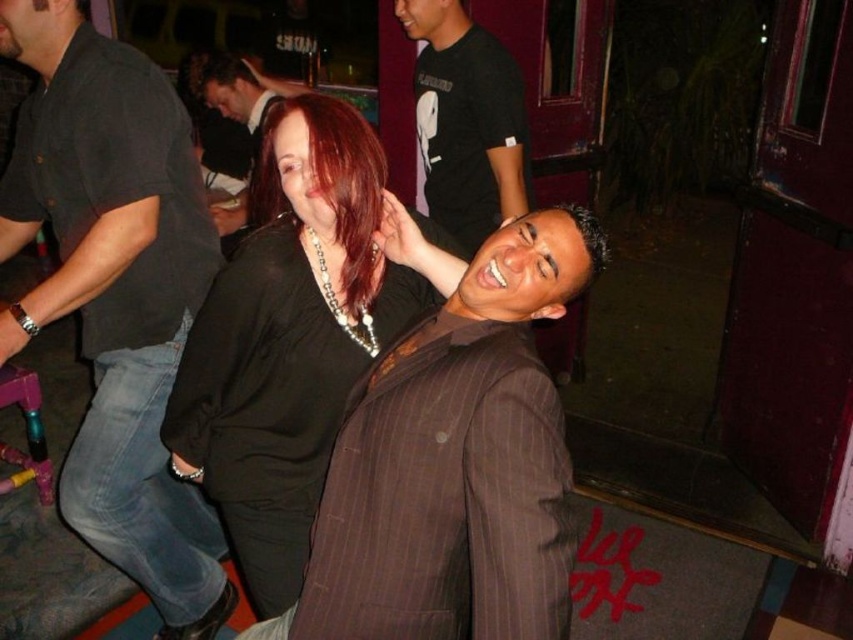
You are standing at the origin point of the image coordinate system. You see two points, point (x=428, y=148) and point (x=200, y=88). Which point is closer to you?

Point (x=428, y=148) is in front of point (x=200, y=88), so it is closer to you.